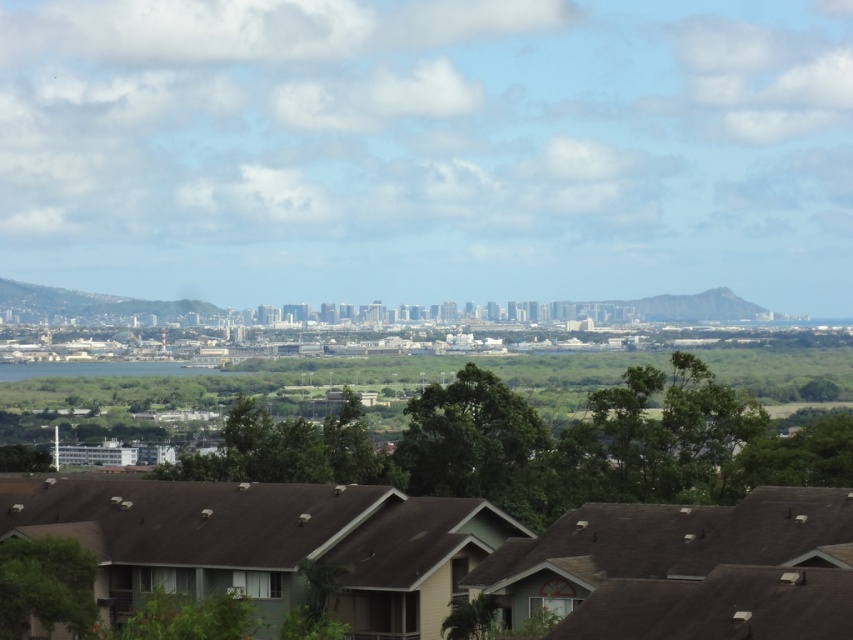
Question: Does green leafy tree at center have a lesser width compared to green leafy tree at lower left?

Choices:
 (A) no
 (B) yes

Answer: (A)

Question: Which of the following is the closest to the observer?

Choices:
 (A) green leafy tree at center
 (B) green leafy tree at lower left

Answer: (B)

Question: Does green leafy tree at center have a lesser width compared to green leafy tree at lower left?

Choices:
 (A) no
 (B) yes

Answer: (A)

Question: Observing the image, what is the correct spatial positioning of green leafy tree at center in reference to green leafy tree at lower left?

Choices:
 (A) right
 (B) left

Answer: (A)

Question: Among these points, which one is nearest to the camera?

Choices:
 (A) (16, 580)
 (B) (422, 396)

Answer: (A)

Question: Which point is farther to the camera?

Choices:
 (A) green leafy tree at lower left
 (B) green leafy tree at center

Answer: (B)